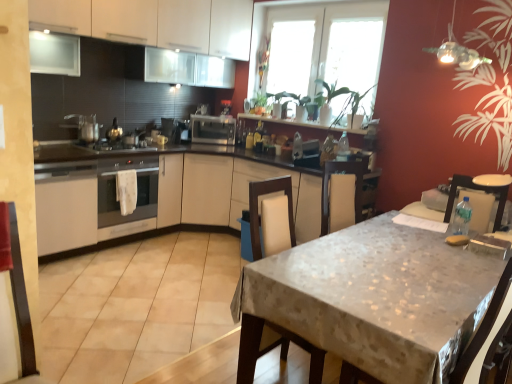
Question: Can you confirm if white matte cabinet at upper left, the 2th cabinetry when ordered from bottom to top, is positioned to the left of satin silver toaster at center, which ranks as the 1th appliance in left-to-right order?

Choices:
 (A) yes
 (B) no

Answer: (B)

Question: Considering the relative sizes of white matte cabinet at upper left, placed as the 1th cabinetry when sorted from top to bottom, and satin silver toaster at center, which is the second appliance from front to back, in the image provided, is white matte cabinet at upper left, placed as the 1th cabinetry when sorted from top to bottom, bigger than satin silver toaster at center, which is the second appliance from front to back,?

Choices:
 (A) no
 (B) yes

Answer: (B)

Question: Is white matte cabinet at upper left, placed as the 1th cabinetry when sorted from top to bottom, facing away from satin silver toaster at center, which ranks as the 1th appliance in left-to-right order?

Choices:
 (A) no
 (B) yes

Answer: (A)

Question: Is white matte cabinet at upper left, the 2th cabinetry when ordered from bottom to top, closer to camera compared to satin silver toaster at center, which is the second appliance from front to back?

Choices:
 (A) yes
 (B) no

Answer: (A)

Question: Does white matte cabinet at upper left, the 2th cabinetry when ordered from bottom to top, have a lesser height compared to satin silver toaster at center, which ranks as the 1th appliance in left-to-right order?

Choices:
 (A) no
 (B) yes

Answer: (A)

Question: Is white matte cabinet at upper left, the 2th cabinetry when ordered from bottom to top, positioned beyond the bounds of satin silver toaster at center, which is the second appliance from front to back?

Choices:
 (A) no
 (B) yes

Answer: (B)

Question: From the image's perspective, is transparent glass window at upper center, which ranks as the first window in right-to-left order, under white fabric swivel chair at right, arranged as the first swivel chair when viewed from the right?

Choices:
 (A) no
 (B) yes

Answer: (A)

Question: Does transparent glass window at upper center, which ranks as the first window in right-to-left order, come in front of white fabric swivel chair at right, the 2th swivel chair when ordered from left to right?

Choices:
 (A) no
 (B) yes

Answer: (A)

Question: Considering the relative positions of transparent glass window at upper center, which is counted as the second window, starting from the left, and white fabric swivel chair at right, arranged as the first swivel chair when viewed from the right, in the image provided, is transparent glass window at upper center, which is counted as the second window, starting from the left, to the right of white fabric swivel chair at right, arranged as the first swivel chair when viewed from the right, from the viewer's perspective?

Choices:
 (A) yes
 (B) no

Answer: (B)

Question: Is transparent glass window at upper center, which ranks as the first window in right-to-left order, oriented away from white fabric swivel chair at right, the 2th swivel chair when ordered from left to right?

Choices:
 (A) yes
 (B) no

Answer: (B)

Question: Considering the relative sizes of transparent glass window at upper center, which ranks as the first window in right-to-left order, and white fabric swivel chair at right, the 2th swivel chair when ordered from left to right, in the image provided, is transparent glass window at upper center, which ranks as the first window in right-to-left order, taller than white fabric swivel chair at right, the 2th swivel chair when ordered from left to right,?

Choices:
 (A) yes
 (B) no

Answer: (A)

Question: Is transparent glass window at upper center, which ranks as the first window in right-to-left order, beside white fabric swivel chair at right, the 2th swivel chair when ordered from left to right?

Choices:
 (A) no
 (B) yes

Answer: (A)

Question: Is satin silver toaster at center, the 3th appliance when ordered from right to left, not inside white matte cabinet at upper left, placed as the 1th cabinetry when sorted from top to bottom?

Choices:
 (A) yes
 (B) no

Answer: (A)